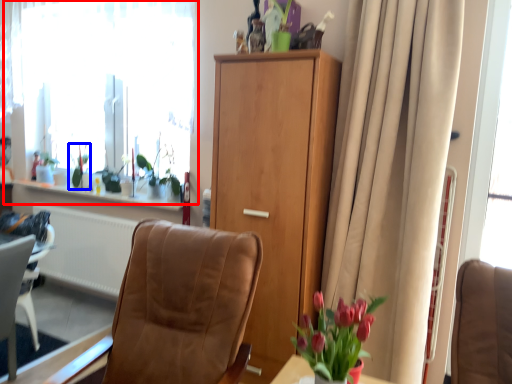
Question: Among these objects, which one is nearest to the camera, window (highlighted by a red box) or plant (highlighted by a blue box)?

Choices:
 (A) window
 (B) plant

Answer: (A)